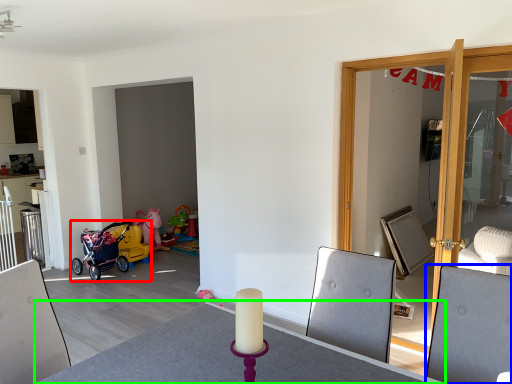
Question: Which object is positioned closest to stroller (highlighted by a red box)? Select from swivel chair (highlighted by a blue box) and round table (highlighted by a green box).

Choices:
 (A) swivel chair
 (B) round table

Answer: (B)